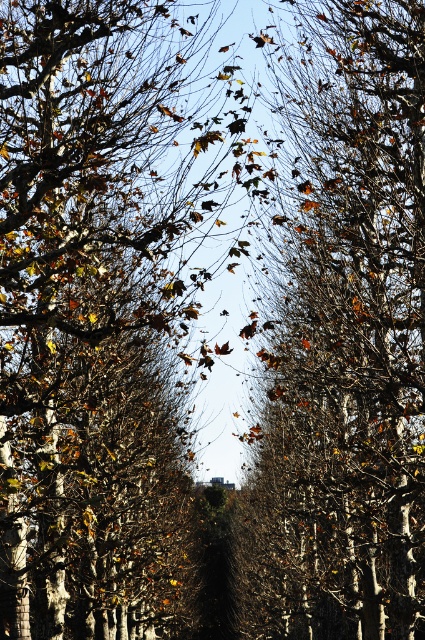
Question: Does brown leafy tree at center lie in front of brown matte tree at center?

Choices:
 (A) no
 (B) yes

Answer: (B)

Question: Which point is farther from the camera taking this photo?

Choices:
 (A) (138, 16)
 (B) (388, 637)

Answer: (B)

Question: Which point is farther to the camera?

Choices:
 (A) (181, 244)
 (B) (282, 243)

Answer: (A)

Question: Is brown leafy tree at center thinner than brown matte tree at center?

Choices:
 (A) yes
 (B) no

Answer: (A)

Question: Among these objects, which one is nearest to the camera?

Choices:
 (A) brown matte tree at center
 (B) brown leafy tree at center

Answer: (B)

Question: Does brown leafy tree at center appear on the right side of brown matte tree at center?

Choices:
 (A) no
 (B) yes

Answer: (A)